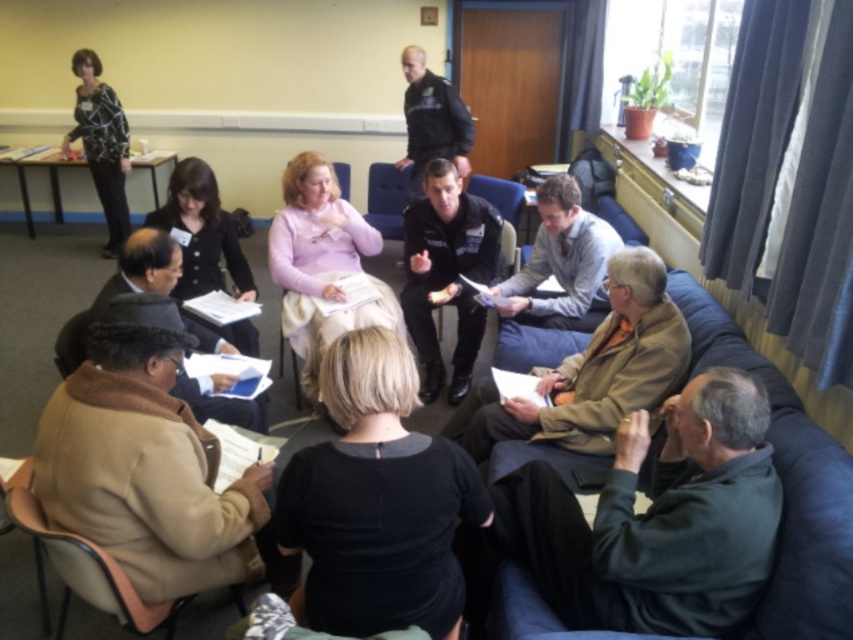
Question: Which object is the closest to the tan leather chair at lower left?

Choices:
 (A) dark gray sweater at lower right
 (B) dark blue uniform at upper center
 (C) brown fuzzy coat at lower left
 (D) brown leather jacket at lower right

Answer: (C)

Question: Which point is closer to the camera?

Choices:
 (A) dark blue uniform at upper center
 (B) blue fabric chair at center
 (C) dark gray sweater at lower right

Answer: (C)

Question: Does light gray shirt at center appear on the left side of tan leather chair at lower left?

Choices:
 (A) yes
 (B) no

Answer: (B)

Question: Is brown leather jacket at lower right closer to the viewer compared to light gray shirt at center?

Choices:
 (A) no
 (B) yes

Answer: (B)

Question: Is blue fabric chair at center behind matte black chair at center?

Choices:
 (A) no
 (B) yes

Answer: (B)

Question: Which of the following is the closest to the observer?

Choices:
 (A) (672, 560)
 (B) (560, 310)

Answer: (A)